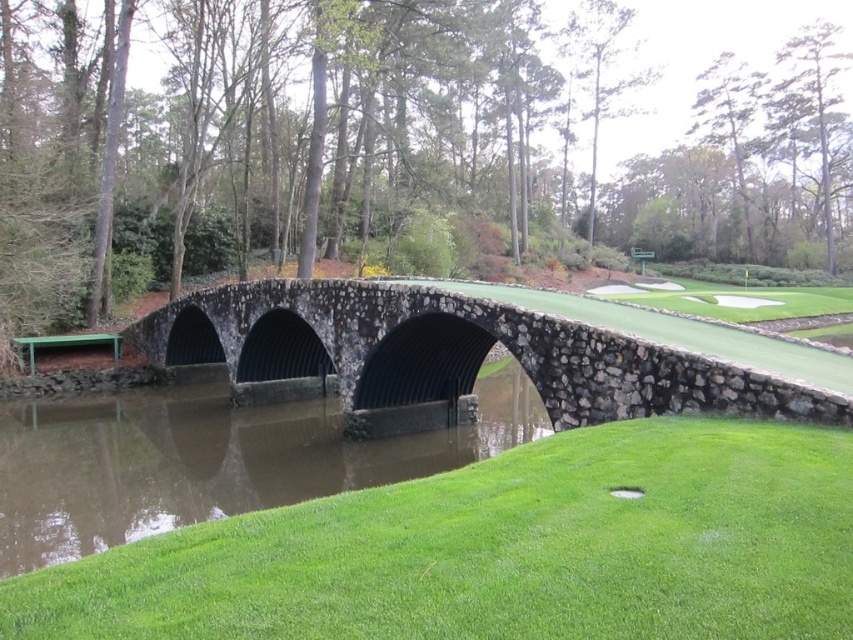
Does green grassy hill at lower center appear on the left side of stone bridge at center?

In fact, green grassy hill at lower center is to the right of stone bridge at center.

Which of these two, green grassy hill at lower center or stone bridge at center, stands shorter?

Standing shorter between the two is green grassy hill at lower center.

Is point (813, 483) farther from viewer compared to point (381, 413)?

No, (813, 483) is closer to viewer.

Where is `green grassy hill at lower center`? This screenshot has width=853, height=640. green grassy hill at lower center is located at coordinates (503, 550).

Between stone bridge at center and brown/muddy water at center, which one appears on the left side from the viewer's perspective?

brown/muddy water at center is more to the left.

Can you confirm if stone bridge at center is positioned to the left of brown/muddy water at center?

In fact, stone bridge at center is to the right of brown/muddy water at center.

The width and height of the screenshot is (853, 640). What are the coordinates of `stone bridge at center` in the screenshot? It's located at (x=485, y=353).

Where is `stone bridge at center`? stone bridge at center is located at coordinates (485, 353).

Can you confirm if green grassy hill at lower center is positioned below brown/muddy water at center?

No.

Can you confirm if green grassy hill at lower center is positioned to the left of brown/muddy water at center?

Incorrect, green grassy hill at lower center is not on the left side of brown/muddy water at center.

Find the location of a particular element. This screenshot has height=640, width=853. green grassy hill at lower center is located at coordinates (503, 550).